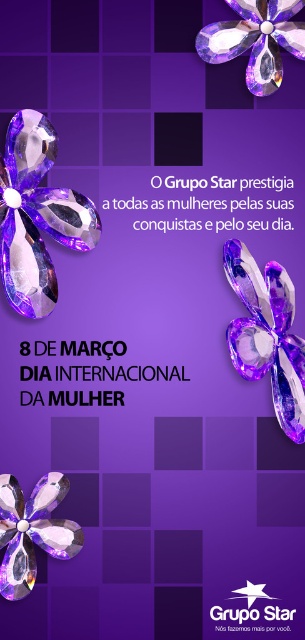
Which is above, matte purple flower at upper right or amber crystal flower at upper center?

Positioned higher is amber crystal flower at upper center.

Can you confirm if matte purple flower at upper right is shorter than amber crystal flower at upper center?

No, matte purple flower at upper right is not shorter than amber crystal flower at upper center.

Between point (300, 353) and point (271, 88), which one is positioned in front?

Point (271, 88) is in front.

Find the location of a particular element. The height and width of the screenshot is (640, 305). matte purple flower at upper right is located at coordinates (266, 333).

Who is taller, crystal clear flower at left or amber crystal flower at upper center?

With more height is crystal clear flower at left.

Locate an element on the screen. This screenshot has width=305, height=640. crystal clear flower at left is located at coordinates (36, 216).

Identify the location of crystal clear flower at left. This screenshot has width=305, height=640. (36, 216).

This screenshot has height=640, width=305. In order to click on crystal clear flower at left in this screenshot , I will do `click(36, 216)`.

Is crystal clear flower at left shorter than matte purple flower at upper right?

Indeed, crystal clear flower at left has a lesser height compared to matte purple flower at upper right.

Can you confirm if crystal clear flower at left is taller than matte purple flower at upper right?

In fact, crystal clear flower at left may be shorter than matte purple flower at upper right.

Measure the distance between point (10, 280) and camera.

Point (10, 280) is 98.71 centimeters away from camera.

Image resolution: width=305 pixels, height=640 pixels. Identify the location of crystal clear flower at left. (36, 216).